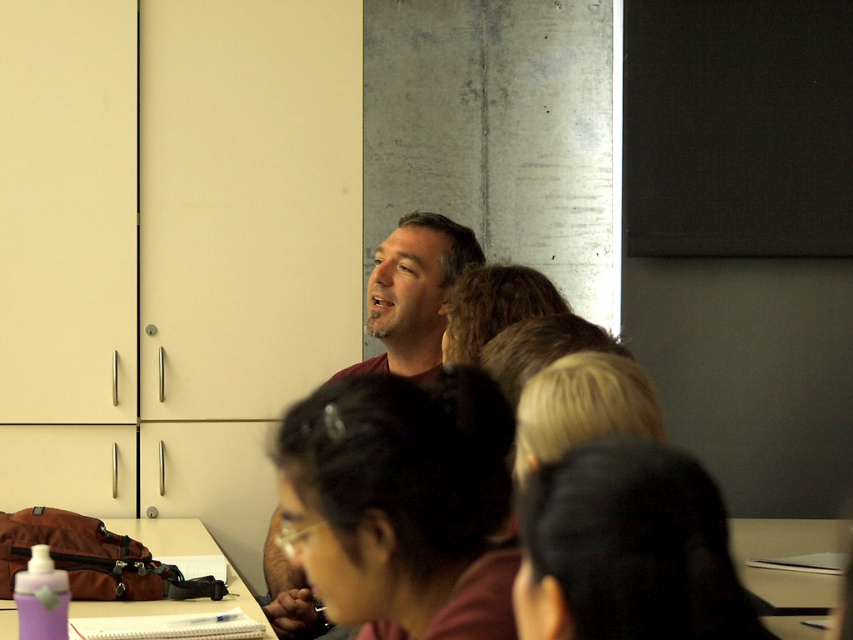
Question: Is matte maroon shirt at center further to camera compared to purple plastic water bottle at lower left?

Choices:
 (A) yes
 (B) no

Answer: (A)

Question: Among these points, which one is nearest to the camera?

Choices:
 (A) (364, 324)
 (B) (120, 609)

Answer: (B)

Question: Does matte maroon shirt at center appear under purple plastic water bottle at lower left?

Choices:
 (A) yes
 (B) no

Answer: (B)

Question: Is matte maroon shirt at center behind purple plastic water bottle at lower left?

Choices:
 (A) yes
 (B) no

Answer: (A)

Question: Which point is closer to the camera?

Choices:
 (A) purple plastic water bottle at lower left
 (B) matte maroon shirt at center

Answer: (A)